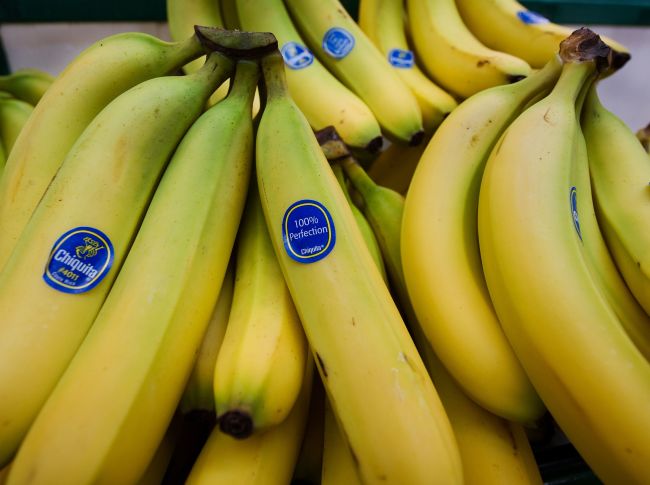
Find the location of a particular element. The image size is (650, 485). stickers is located at coordinates (575, 212), (317, 232), (86, 254), (299, 54), (338, 39), (403, 58), (534, 18).